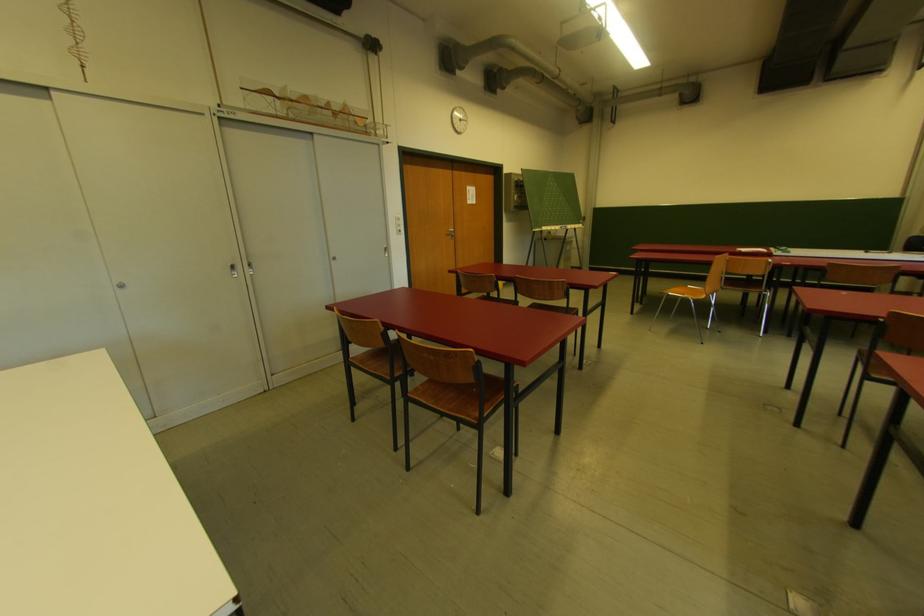
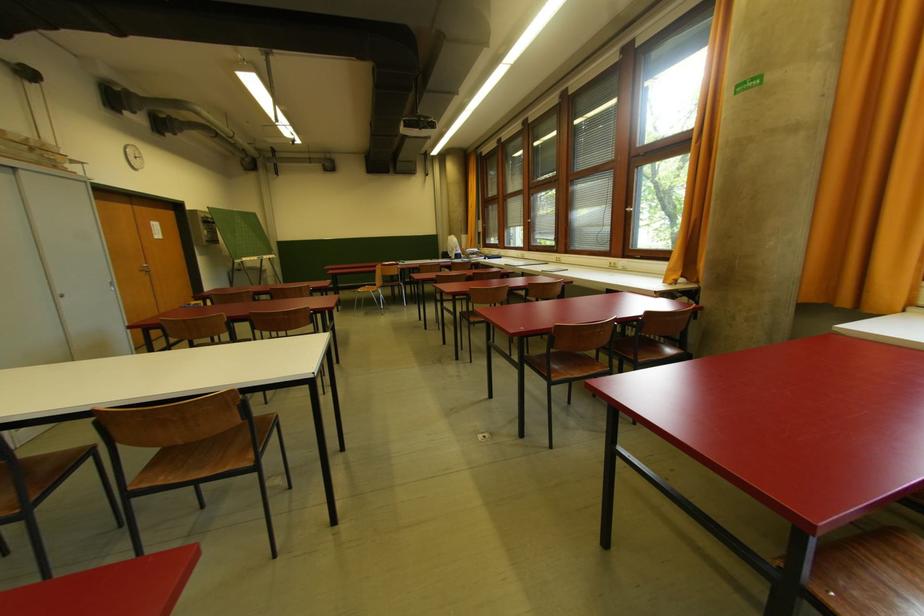
In the second image, find the point that corresponds to point (451, 237) in the first image.

(144, 273)